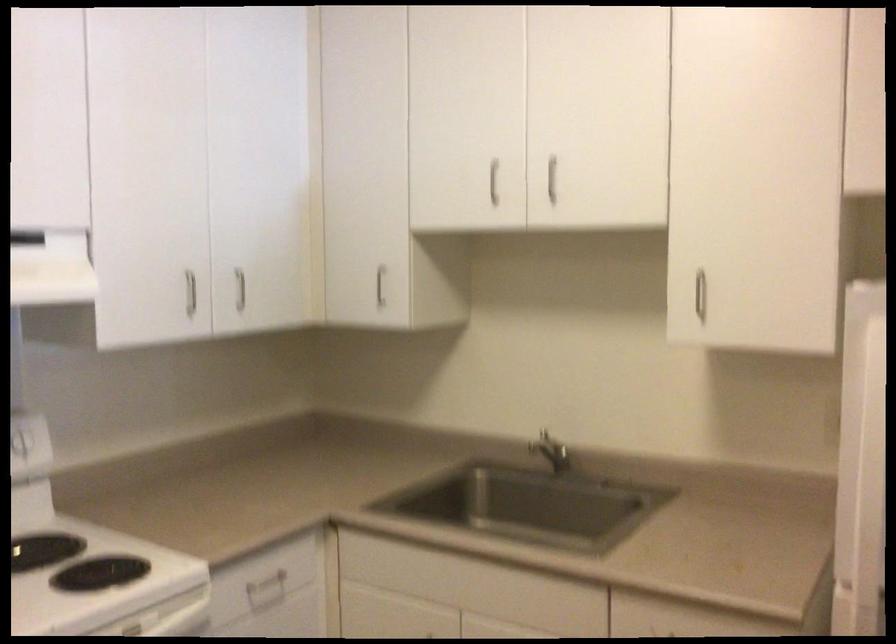
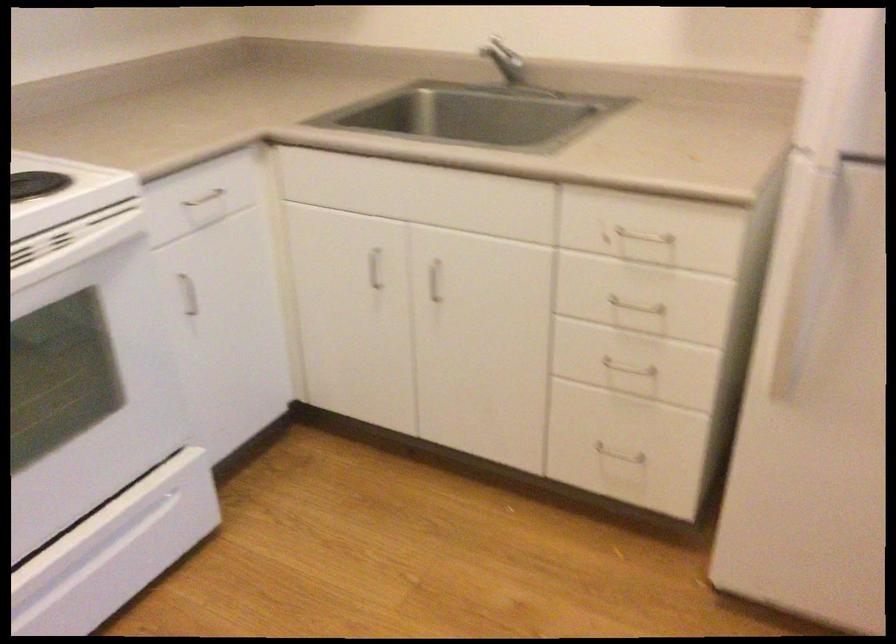
The point at (x=561, y=455) is marked in the first image. Where is the corresponding point in the second image?

(510, 68)